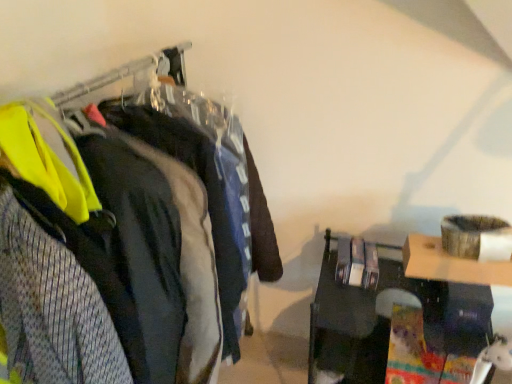
Question: Considering the relative positions of matte black jacket at left and yellow reflective vest at left, which is counted as the 1th clothing, starting from the front, in the image provided, is matte black jacket at left to the left of yellow reflective vest at left, which is counted as the 1th clothing, starting from the front, from the viewer's perspective?

Choices:
 (A) yes
 (B) no

Answer: (B)

Question: Does matte black jacket at left have a smaller size compared to yellow reflective vest at left, which is counted as the second clothing, starting from the back?

Choices:
 (A) no
 (B) yes

Answer: (A)

Question: Does matte black jacket at left have a lesser height compared to yellow reflective vest at left, which is counted as the 1th clothing, starting from the front?

Choices:
 (A) yes
 (B) no

Answer: (B)

Question: From the image's perspective, is matte black jacket at left located beneath yellow reflective vest at left, which is counted as the 1th clothing, starting from the front?

Choices:
 (A) yes
 (B) no

Answer: (A)

Question: Is matte black jacket at left far away from yellow reflective vest at left, which is counted as the 1th clothing, starting from the front?

Choices:
 (A) yes
 (B) no

Answer: (B)

Question: Looking at their shapes, would you say yellow reflective vest at left, which is counted as the 1th clothing, starting from the front, is wider or thinner than matte black jacket at left?

Choices:
 (A) wide
 (B) thin

Answer: (A)

Question: Is yellow reflective vest at left, which is counted as the second clothing, starting from the back, situated inside matte black jacket at left or outside?

Choices:
 (A) inside
 (B) outside

Answer: (A)

Question: From their relative heights in the image, would you say yellow reflective vest at left, which is counted as the second clothing, starting from the back, is taller or shorter than matte black jacket at left?

Choices:
 (A) tall
 (B) short

Answer: (B)

Question: From a real-world perspective, is yellow reflective vest at left, which is counted as the 1th clothing, starting from the front, above or below matte black jacket at left?

Choices:
 (A) above
 (B) below

Answer: (A)

Question: Looking at their shapes, would you say matte black jacket at left is wider or thinner than yellow reflective vest at left, which is counted as the 1th clothing, starting from the front?

Choices:
 (A) wide
 (B) thin

Answer: (B)

Question: In terms of height, does matte black jacket at left look taller or shorter compared to yellow reflective vest at left, which is counted as the second clothing, starting from the back?

Choices:
 (A) tall
 (B) short

Answer: (A)

Question: Relative to yellow reflective vest at left, which is counted as the 1th clothing, starting from the front, is matte black jacket at left in front or behind?

Choices:
 (A) behind
 (B) front

Answer: (A)

Question: Is matte black jacket at left situated inside yellow reflective vest at left, which is counted as the 1th clothing, starting from the front, or outside?

Choices:
 (A) outside
 (B) inside

Answer: (A)

Question: Considering their positions, is matte black jacket at left, positioned as the second clothing in front-to-back order, located in front of or behind matte black jacket at left?

Choices:
 (A) behind
 (B) front

Answer: (A)

Question: Considering the positions of matte black jacket at left, positioned as the second clothing in front-to-back order, and matte black jacket at left in the image, is matte black jacket at left, positioned as the second clothing in front-to-back order, wider or thinner than matte black jacket at left?

Choices:
 (A) wide
 (B) thin

Answer: (A)